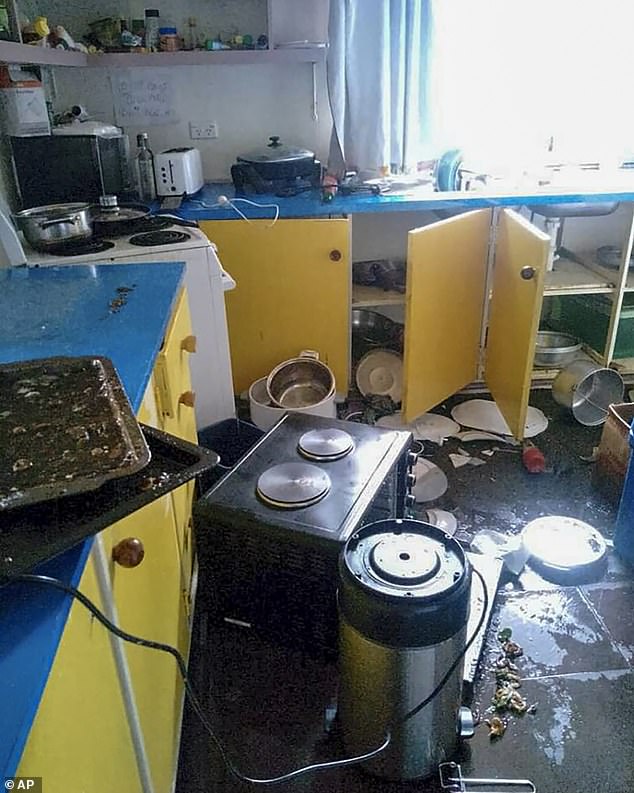
Locate an element on the screen. Image resolution: width=634 pixels, height=793 pixels. pans is located at coordinates (68, 442), (74, 508).